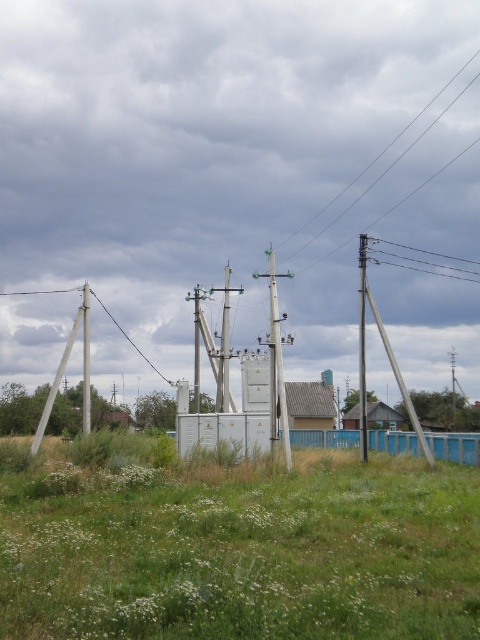
Question: Does green grass at center appear on the left side of white plastic telegraph pole at center?

Choices:
 (A) yes
 (B) no

Answer: (B)

Question: Does smooth wooden telegraph pole at right appear over metallic wire at upper right?

Choices:
 (A) no
 (B) yes

Answer: (A)

Question: Among these points, which one is nearest to the camera?

Choices:
 (A) (83, 353)
 (B) (165, 576)
 (C) (433, 253)

Answer: (B)

Question: Which is farther from the white plastic telegraph pole at left?

Choices:
 (A) metallic wire at upper center
 (B) white plastic telegraph pole at center
 (C) green grass at center
 (D) green metallic pole at center

Answer: (A)

Question: Can you confirm if green grass at center is positioned to the left of white plastic telegraph pole at center?

Choices:
 (A) yes
 (B) no

Answer: (B)

Question: Which is nearer to the green grass at center?

Choices:
 (A) green metallic pole at center
 (B) white plastic telegraph pole at center
 (C) metallic wire at upper right

Answer: (A)